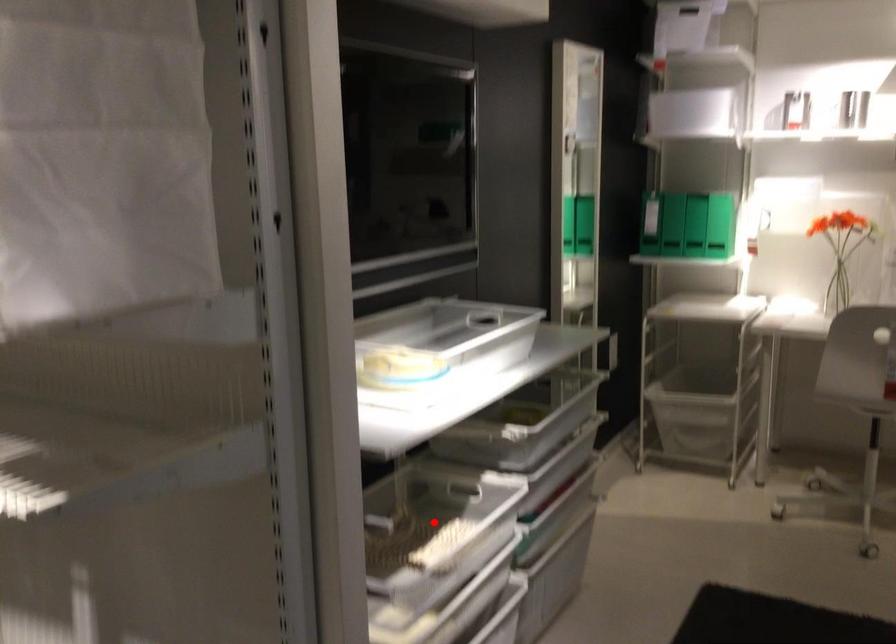
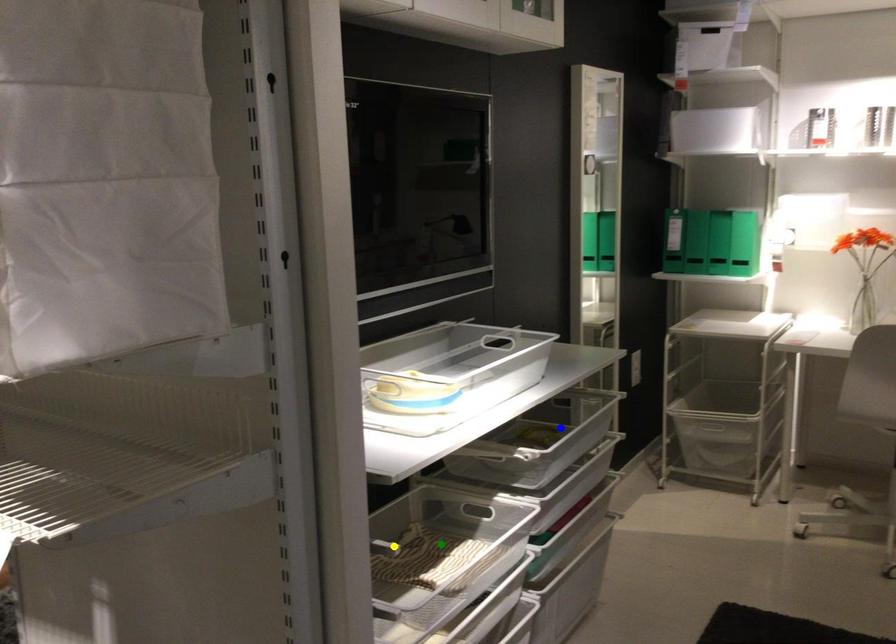
Question: I am providing you with two images of the same scene from different viewpoints. A red point is marked on the first image. You are given multiple points on the second image. In image 2, which mark is for the same physical point as the one in image 1?

Choices:
 (A) yellow point
 (B) green point
 (C) blue point

Answer: (B)